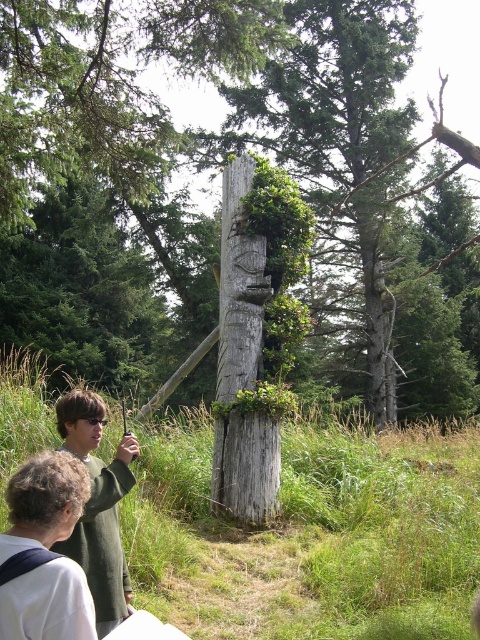
Is point (278, 486) more distant than point (126, 436)?

That is True.

Does weathered wood totem at center appear over green wool sweater at lower left?

Yes, weathered wood totem at center is above green wool sweater at lower left.

Find the location of a particular element. The width and height of the screenshot is (480, 640). weathered wood totem at center is located at coordinates (242, 365).

Where is `weathered wood totem at center`? weathered wood totem at center is located at coordinates (242, 365).

In the scene shown: Does weathered wood totem pole at center appear on the left side of green wool sweater at lower left?

Incorrect, weathered wood totem pole at center is not on the left side of green wool sweater at lower left.

From the picture: Can you confirm if weathered wood totem pole at center is bigger than green wool sweater at lower left?

Yes, weathered wood totem pole at center is bigger than green wool sweater at lower left.

Does point (32, 230) come behind point (81, 388)?

Yes, it is.

Where is `weathered wood totem pole at center`? The image size is (480, 640). weathered wood totem pole at center is located at coordinates (214, 172).

Does point (147, 333) come behind point (43, 522)?

Yes.

Does weathered wood totem pole at center appear on the left side of green fabric shirt at lower left?

No, weathered wood totem pole at center is not to the left of green fabric shirt at lower left.

You are a GUI agent. You are given a task and a screenshot of the screen. Output one action in this format:
    pyautogui.click(x=<x>, y=<y>)
    Task: Click on the weathered wood totem pole at center
    
    Given the screenshot: What is the action you would take?
    pyautogui.click(x=214, y=172)